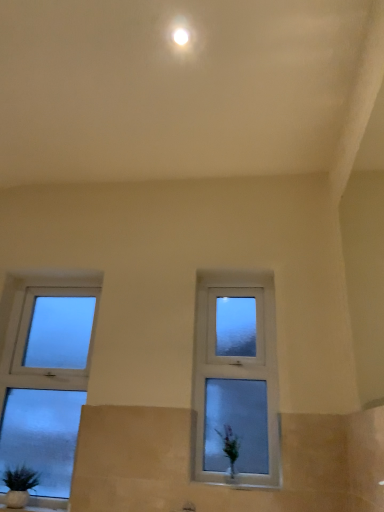
Describe the element at coordinates (241, 484) in the screenshot. I see `white glossy vase at lower center` at that location.

In order to face green matte plant at lower left, should I rotate leftwards or rightwards?

It's best to rotate left around 21.764 degrees.

Measure the distance between point [177,36] and camera.

The distance of point [177,36] from camera is 1.60 meters.

What do you see at coordinates (180, 36) in the screenshot? I see `white glossy light at upper center` at bounding box center [180, 36].

This screenshot has width=384, height=512. I want to click on white glossy vase at lower center, so click(x=241, y=484).

Is white glossy vase at lower center oriented away from clear glass window at center, which appears as the first window when viewed from the right?

No, white glossy vase at lower center's orientation is not away from clear glass window at center, which appears as the first window when viewed from the right.

From the image's perspective, is white glossy vase at lower center beneath clear glass window at center, arranged as the second window when viewed from the left?

Indeed, from the image's perspective, white glossy vase at lower center is shown beneath clear glass window at center, arranged as the second window when viewed from the left.

Which object is thinner, white glossy vase at lower center or clear glass window at center, arranged as the second window when viewed from the left?

Thinner between the two is clear glass window at center, arranged as the second window when viewed from the left.

From a real-world perspective, is white glossy vase at lower center physically below clear glass window at center, arranged as the second window when viewed from the left?

Correct, in the physical world, white glossy vase at lower center is lower than clear glass window at center, arranged as the second window when viewed from the left.

From a real-world perspective, which is physically below, clear glass window at center, which appears as the first window when viewed from the right, or frosted glass window at left, which ranks as the first window in left-to-right order?

frosted glass window at left, which ranks as the first window in left-to-right order.

Does clear glass window at center, which appears as the first window when viewed from the right, lie behind frosted glass window at left, which ranks as the first window in left-to-right order?

No, clear glass window at center, which appears as the first window when viewed from the right, is in front of frosted glass window at left, which ranks as the first window in left-to-right order.

Is clear glass window at center, which appears as the first window when viewed from the right, wider or thinner than frosted glass window at left, which ranks as the 2th window in right-to-left order?

Clearly, clear glass window at center, which appears as the first window when viewed from the right, has less width compared to frosted glass window at left, which ranks as the 2th window in right-to-left order.

Consider the image. Considering the relative sizes of green matte plant at lower left and clear glass window at center, arranged as the second window when viewed from the left, in the image provided, is green matte plant at lower left smaller than clear glass window at center, arranged as the second window when viewed from the left,?

Yes.

Considering the points (39, 476) and (266, 433), which point is behind, point (39, 476) or point (266, 433)?

The point (39, 476) is behind.

Is green matte plant at lower left facing away from clear glass window at center, which appears as the first window when viewed from the right?

green matte plant at lower left does not have its back to clear glass window at center, which appears as the first window when viewed from the right.

Is the depth of green matte plant at lower left greater than that of clear glass window at center, which appears as the first window when viewed from the right?

No, it is in front of clear glass window at center, which appears as the first window when viewed from the right.

Based on the photo, from the image's perspective, who appears lower, white glossy vase at lower center or white glossy light at upper center?

white glossy vase at lower center.

Which is farther from the camera, (251, 487) or (180, 39)?

The point (251, 487) is farther.

Is white glossy vase at lower center far away from white glossy light at upper center?

Indeed, white glossy vase at lower center is not near white glossy light at upper center.

How many degrees apart are the facing directions of clear glass window at center, which appears as the first window when viewed from the right, and white glossy vase at lower center?

They differ by 0.000169 degrees in their facing directions.

Is clear glass window at center, arranged as the second window when viewed from the left, positioned behind white glossy vase at lower center?

Yes, it is behind white glossy vase at lower center.

Which is behind, point (202, 323) or point (237, 481)?

Positioned behind is point (202, 323).

Can you confirm if clear glass window at center, arranged as the second window when viewed from the left, is taller than white glossy vase at lower center?

Correct, clear glass window at center, arranged as the second window when viewed from the left, is much taller as white glossy vase at lower center.

The image size is (384, 512). I want to click on houseplant beneath the clear glass window at center, which appears as the first window when viewed from the right (from a real-world perspective), so click(x=19, y=486).

Which object is thinner, clear glass window at center, which appears as the first window when viewed from the right, or green matte plant at lower left?

Thinner between the two is clear glass window at center, which appears as the first window when viewed from the right.

Between clear glass window at center, which appears as the first window when viewed from the right, and green matte plant at lower left, which one has larger size?

Bigger between the two is clear glass window at center, which appears as the first window when viewed from the right.

From a real-world perspective, is clear glass window at center, arranged as the second window when viewed from the left, physically below green matte plant at lower left?

Incorrect, from a real-world perspective, clear glass window at center, arranged as the second window when viewed from the left, is higher than green matte plant at lower left.

Between frosted glass window at left, which ranks as the first window in left-to-right order, and green matte plant at lower left, which one appears on the left side from the viewer's perspective?

Positioned to the left is green matte plant at lower left.

Is frosted glass window at left, which ranks as the 2th window in right-to-left order, not near green matte plant at lower left?

No, frosted glass window at left, which ranks as the 2th window in right-to-left order, is in close proximity to green matte plant at lower left.

In the scene shown: How different are the orientations of frosted glass window at left, which ranks as the first window in left-to-right order, and green matte plant at lower left in degrees?

7.93e-05 degrees separate the facing orientations of frosted glass window at left, which ranks as the first window in left-to-right order, and green matte plant at lower left.

Is frosted glass window at left, which ranks as the 2th window in right-to-left order, surrounding green matte plant at lower left?

Actually, green matte plant at lower left is outside frosted glass window at left, which ranks as the 2th window in right-to-left order.

Image resolution: width=384 pixels, height=512 pixels. Find the location of `window sill on the left of clear glass window at center, arranged as the second window when viewed from the left`. window sill on the left of clear glass window at center, arranged as the second window when viewed from the left is located at coordinates point(241,484).

This screenshot has width=384, height=512. What are the coordinates of `window below the clear glass window at center, which appears as the first window when viewed from the right (from a real-world perspective)` in the screenshot? It's located at (46, 378).

Consider the image. Based on their spatial positions, is white glossy vase at lower center or green matte plant at lower left closer to frosted glass window at left, which ranks as the 2th window in right-to-left order?

The object closer to frosted glass window at left, which ranks as the 2th window in right-to-left order, is green matte plant at lower left.

From the image, which object appears to be nearer to white glossy light at upper center, frosted glass window at left, which ranks as the 2th window in right-to-left order, or white glossy vase at lower center?

frosted glass window at left, which ranks as the 2th window in right-to-left order, is closer to white glossy light at upper center.

From the image, which object appears to be farther from white glossy vase at lower center, frosted glass window at left, which ranks as the 2th window in right-to-left order, or green matte plant at lower left?

The object further to white glossy vase at lower center is frosted glass window at left, which ranks as the 2th window in right-to-left order.

From the picture: From the image, which object appears to be farther from green matte plant at lower left, white glossy light at upper center or white glossy vase at lower center?

white glossy light at upper center.

From the image, which object appears to be nearer to green matte plant at lower left, white glossy vase at lower center or frosted glass window at left, which ranks as the 2th window in right-to-left order?

frosted glass window at left, which ranks as the 2th window in right-to-left order, is positioned closer to the anchor green matte plant at lower left.

Looking at the image, which one is located closer to frosted glass window at left, which ranks as the 2th window in right-to-left order, clear glass window at center, arranged as the second window when viewed from the left, or green matte plant at lower left?

green matte plant at lower left.

From the image, which object appears to be nearer to clear glass window at center, which appears as the first window when viewed from the right, white glossy vase at lower center or green matte plant at lower left?

white glossy vase at lower center.

Looking at the image, which one is located closer to green matte plant at lower left, white glossy light at upper center or frosted glass window at left, which ranks as the first window in left-to-right order?

frosted glass window at left, which ranks as the first window in left-to-right order, lies closer to green matte plant at lower left than the other object.

This screenshot has width=384, height=512. Find the location of `window sill between white glossy light at upper center and green matte plant at lower left in the up-down direction`. window sill between white glossy light at upper center and green matte plant at lower left in the up-down direction is located at coordinates (241, 484).

Identify the location of window sill between green matte plant at lower left and clear glass window at center, arranged as the second window when viewed from the left, from left to right. (241, 484).

I want to click on window between green matte plant at lower left and white glossy vase at lower center from left to right, so [46, 378].

This screenshot has width=384, height=512. What are the coordinates of `window sill between frosted glass window at left, which ranks as the 2th window in right-to-left order, and clear glass window at center, which appears as the first window when viewed from the right` in the screenshot? It's located at (241, 484).